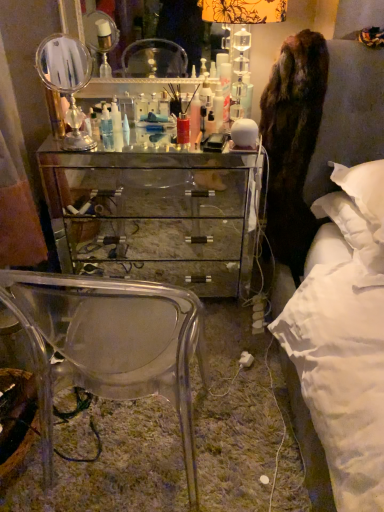
Question: Is clear acrylic mirror at center, the second mirror from the bottom, positioned behind mirrored glass chest of drawers at center?

Choices:
 (A) yes
 (B) no

Answer: (A)

Question: Can you confirm if clear acrylic mirror at center, the 2th mirror when ordered from front to back, is thinner than mirrored glass chest of drawers at center?

Choices:
 (A) no
 (B) yes

Answer: (B)

Question: Is clear acrylic mirror at center, the 2th mirror when ordered from front to back, smaller than mirrored glass chest of drawers at center?

Choices:
 (A) no
 (B) yes

Answer: (B)

Question: Is clear acrylic mirror at center, the first mirror from the top, bigger than mirrored glass chest of drawers at center?

Choices:
 (A) yes
 (B) no

Answer: (B)

Question: In the image, is brown furry coat at right positioned in front of or behind silver metallic mirror at upper left, the second mirror from the top?

Choices:
 (A) front
 (B) behind

Answer: (A)

Question: Considering the positions of point (278, 138) and point (61, 86), is point (278, 138) closer or farther from the camera than point (61, 86)?

Choices:
 (A) farther
 (B) closer

Answer: (A)

Question: Based on their sizes in the image, would you say brown furry coat at right is bigger or smaller than silver metallic mirror at upper left, the second mirror from the top?

Choices:
 (A) big
 (B) small

Answer: (A)

Question: From a real-world perspective, is brown furry coat at right positioned above or below silver metallic mirror at upper left, acting as the 1th mirror starting from the front?

Choices:
 (A) above
 (B) below

Answer: (B)

Question: Visually, is brown furry coat at right positioned to the left or to the right of white glossy bottle at center, the third toiletry positioned from the left?

Choices:
 (A) right
 (B) left

Answer: (A)

Question: In terms of width, does brown furry coat at right look wider or thinner when compared to white glossy bottle at center, which is the 1th toiletry from right to left?

Choices:
 (A) wide
 (B) thin

Answer: (A)

Question: From a real-world perspective, is brown furry coat at right above or below white glossy bottle at center, the third toiletry positioned from the left?

Choices:
 (A) below
 (B) above

Answer: (A)

Question: Based on their sizes in the image, would you say brown furry coat at right is bigger or smaller than white glossy bottle at center, which is the 1th toiletry from right to left?

Choices:
 (A) big
 (B) small

Answer: (A)

Question: From the image's perspective, is white fluffy pillow at right positioned above or below translucent plastic bottle at center, arranged as the third toiletry when viewed from the right?

Choices:
 (A) below
 (B) above

Answer: (A)

Question: From a real-world perspective, is white fluffy pillow at right above or below translucent plastic bottle at center, arranged as the third toiletry when viewed from the right?

Choices:
 (A) above
 (B) below

Answer: (B)